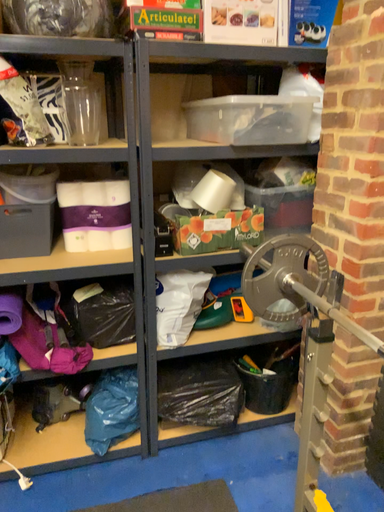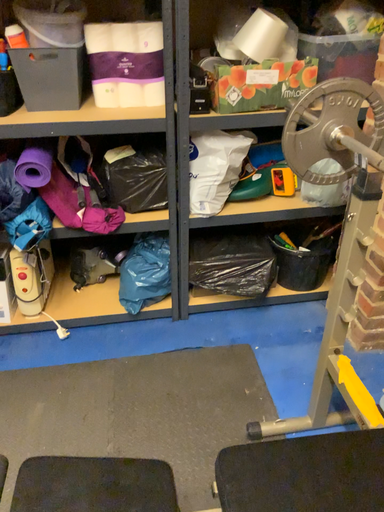
Question: Which way did the camera rotate in the video?

Choices:
 (A) rotated downward
 (B) rotated upward

Answer: (A)